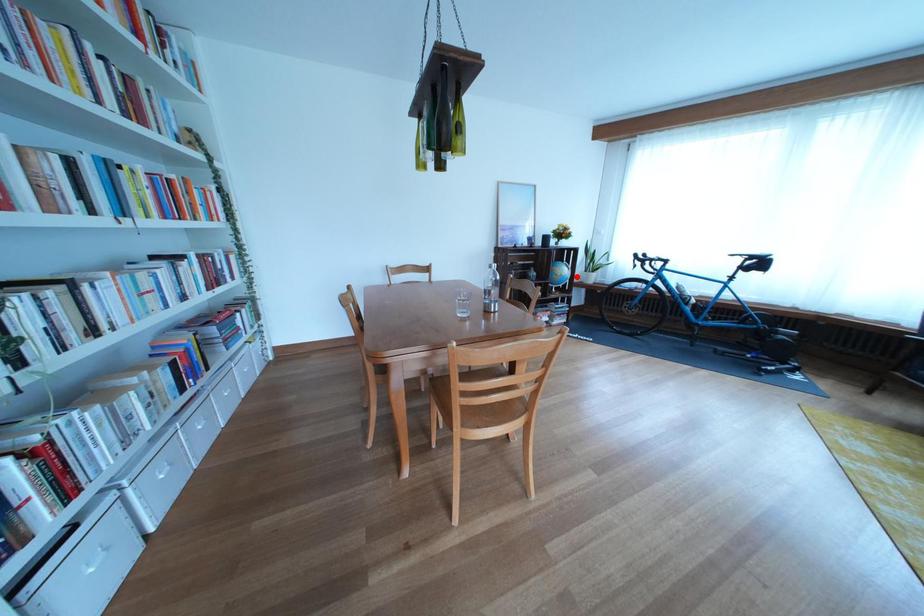
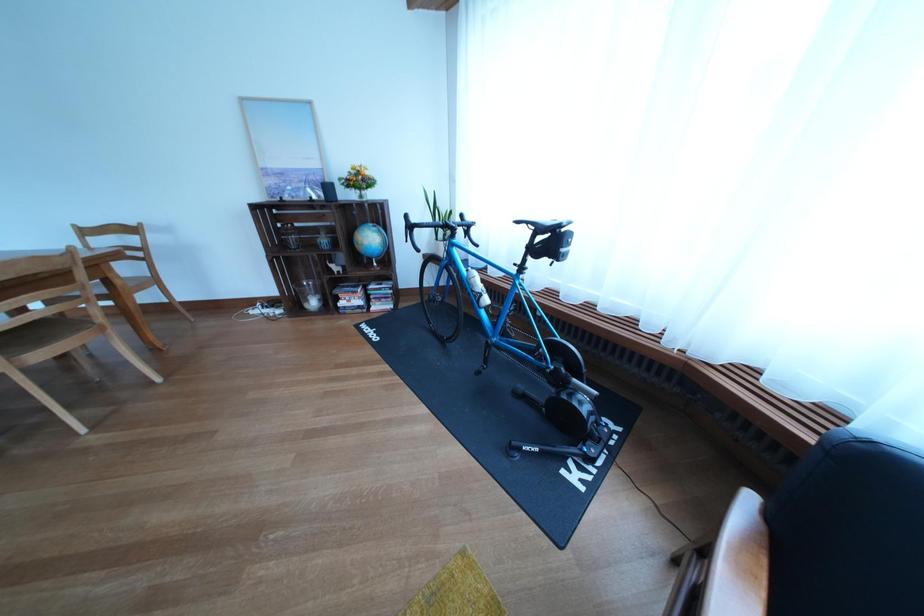
Question: I am providing you with two images of the same scene from different viewpoints. Given a red point in image1, look at the same physical point in image2. Is it:

Choices:
 (A) Closer to the viewpoint
 (B) Farther from the viewpoint

Answer: (A)